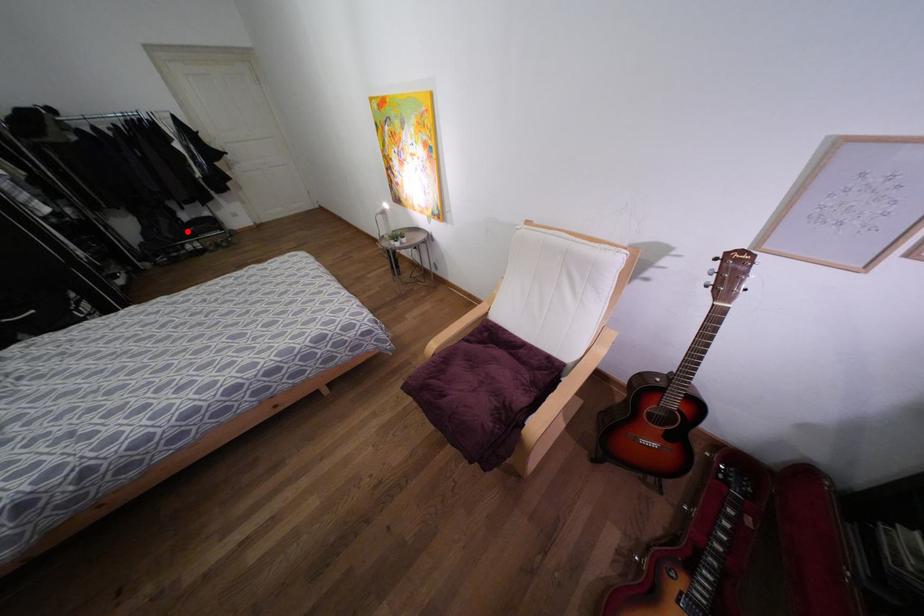
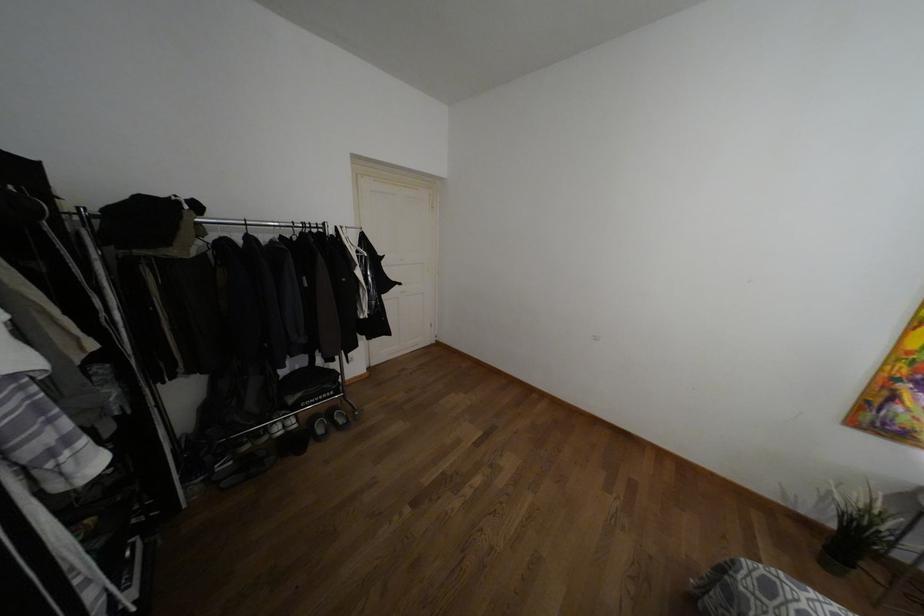
Find the pixel in the second image that matches the highlighted location in the first image.

(290, 399)